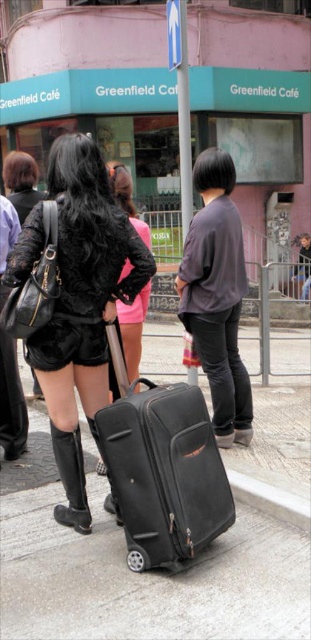
Question: Considering the relative positions of velvet black shorts at center and matte black shorts at center in the image provided, where is velvet black shorts at center located with respect to matte black shorts at center?

Choices:
 (A) below
 (B) above

Answer: (A)

Question: Which point is closer to the camera?

Choices:
 (A) (82, 467)
 (B) (110, 506)
 (C) (117, 172)
 (D) (27, 500)

Answer: (A)

Question: Considering the relative positions of black matte suitcase at center and black leather boot at lower left in the image provided, where is black matte suitcase at center located with respect to black leather boot at lower left?

Choices:
 (A) left
 (B) right

Answer: (B)

Question: Which of the following is the closest to the observer?

Choices:
 (A) (259, 614)
 (B) (114, 337)
 (C) (129, 337)

Answer: (A)

Question: Which point is closer to the camera?

Choices:
 (A) (163, 547)
 (B) (254, 358)

Answer: (A)

Question: Is velvet black shorts at center bigger than matte black shorts at center?

Choices:
 (A) yes
 (B) no

Answer: (A)